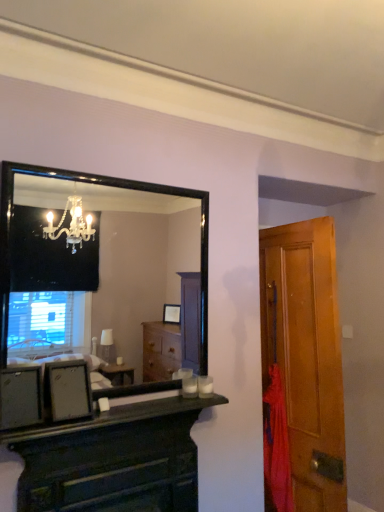
Question: Relative to matte black picture frame at lower left, is wooden door at right in front or behind?

Choices:
 (A) front
 (B) behind

Answer: (B)

Question: Would you say wooden door at right is to the left or to the right of matte black picture frame at lower left in the picture?

Choices:
 (A) right
 (B) left

Answer: (A)

Question: Estimate the real-world distances between objects in this image. Which object is closer to the matte black picture frame at lower left?

Choices:
 (A) black glossy mirror at upper left
 (B) wooden door at right
 (C) red fabric at right
 (D) dark wood chest of drawers at center

Answer: (D)

Question: Which object is positioned closest to the black glossy mirror at upper left?

Choices:
 (A) red fabric at right
 (B) wooden door at right
 (C) matte black picture frame at lower left
 (D) dark wood chest of drawers at center

Answer: (B)